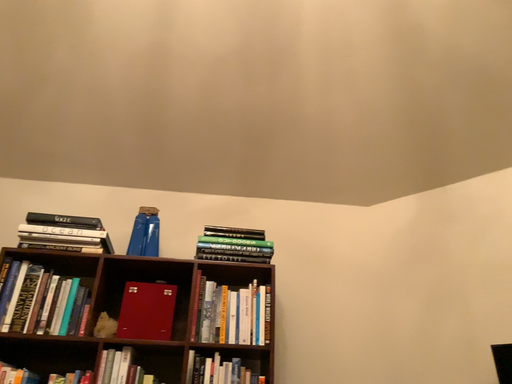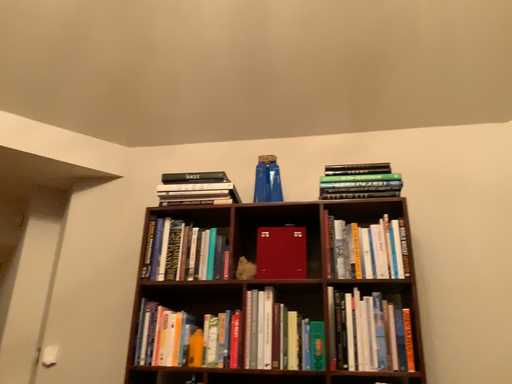
Question: How did the camera likely rotate when shooting the video?

Choices:
 (A) rotated right
 (B) rotated left

Answer: (B)